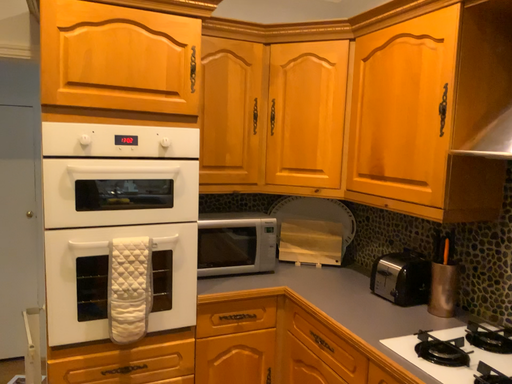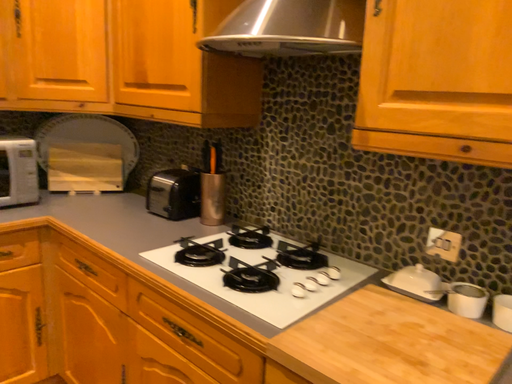
Question: Which way did the camera rotate in the video?

Choices:
 (A) rotated downward
 (B) rotated upward

Answer: (A)